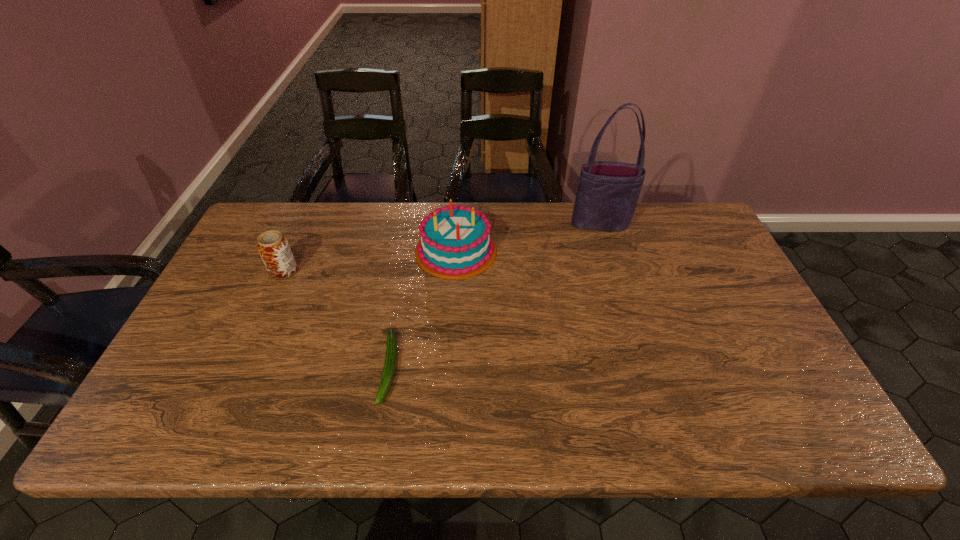
You are a GUI agent. You are given a task and a screenshot of the screen. Output one action in this format:
    pyautogui.click(x=<x>, y=<y>)
    Task: Click on the unoccupied position between the shortest object and the tallest object
    The height and width of the screenshot is (540, 960).
    Given the screenshot: What is the action you would take?
    pyautogui.click(x=494, y=296)

Where is `free space between the third shortest object and the shortest object`? This screenshot has width=960, height=540. free space between the third shortest object and the shortest object is located at coordinates coord(422,309).

You are a GUI agent. You are given a task and a screenshot of the screen. Output one action in this format:
    pyautogui.click(x=<x>, y=<y>)
    Task: Click on the vacant area between the second shortest object and the second tallest object
    Image resolution: width=960 pixels, height=540 pixels.
    Given the screenshot: What is the action you would take?
    pyautogui.click(x=370, y=261)

At what (x,y) coordinates should I click in order to perform the action: click on vacant area that lies between the zucchini and the rightmost object. Please return your answer as a coordinate pair (x, y). The width and height of the screenshot is (960, 540). Looking at the image, I should click on (494, 296).

Locate an element on the screen. The width and height of the screenshot is (960, 540). free space between the birthday cake and the zucchini is located at coordinates (422, 309).

Where is `free area in between the zucchini and the second tallest object`? free area in between the zucchini and the second tallest object is located at coordinates (422, 309).

In order to click on free space between the zucchini and the second shortest object in this screenshot , I will do `click(337, 320)`.

Find the location of a particular element. the third closest object to the birthday cake is located at coordinates (273, 247).

Point out which object is positioned as the second nearest to the zucchini. Please provide its 2D coordinates. Your answer should be formatted as a tuple, i.e. [(x, y)], where the tuple contains the x and y coordinates of a point satisfying the conditions above.

[(273, 247)]

Identify the location of vacant space that satisfies the following two spatial constraints: 1. on the back side of the third shortest object; 2. on the left side of the tote bag. This screenshot has width=960, height=540. coord(458,224).